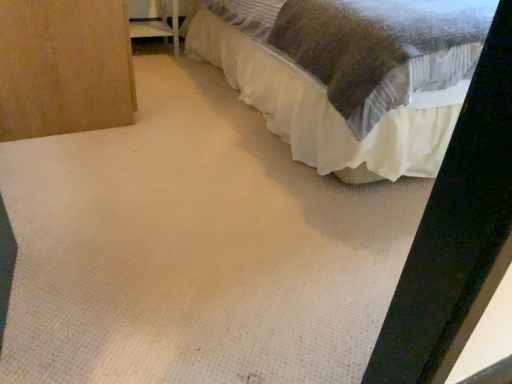
Question: In terms of size, does white plastic shelf at upper left appear bigger or smaller than white textured bed at upper right?

Choices:
 (A) small
 (B) big

Answer: (A)

Question: Choose the correct answer: Is white plastic shelf at upper left inside white textured bed at upper right or outside it?

Choices:
 (A) outside
 (B) inside

Answer: (A)

Question: Considering the positions of white plastic shelf at upper left and white textured bed at upper right in the image, is white plastic shelf at upper left wider or thinner than white textured bed at upper right?

Choices:
 (A) thin
 (B) wide

Answer: (A)

Question: Is white textured bed at upper right inside or outside of white plastic shelf at upper left?

Choices:
 (A) outside
 (B) inside

Answer: (A)

Question: In the image, is white textured bed at upper right on the left side or the right side of white plastic shelf at upper left?

Choices:
 (A) right
 (B) left

Answer: (A)

Question: Looking at the image, does white textured bed at upper right seem bigger or smaller compared to white plastic shelf at upper left?

Choices:
 (A) big
 (B) small

Answer: (A)

Question: Is point (362, 77) positioned closer to the camera than point (131, 19)?

Choices:
 (A) closer
 (B) farther

Answer: (A)